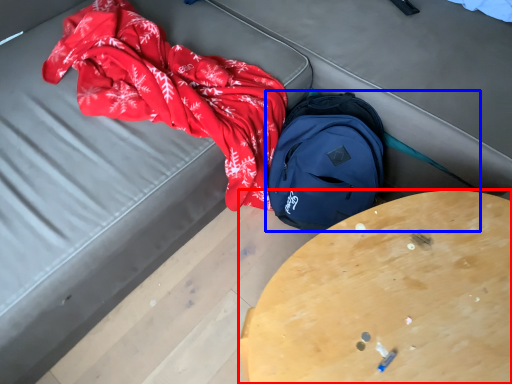
Question: Among these objects, which one is nearest to the camera, table (highlighted by a red box) or backpack (highlighted by a blue box)?

Choices:
 (A) table
 (B) backpack

Answer: (A)